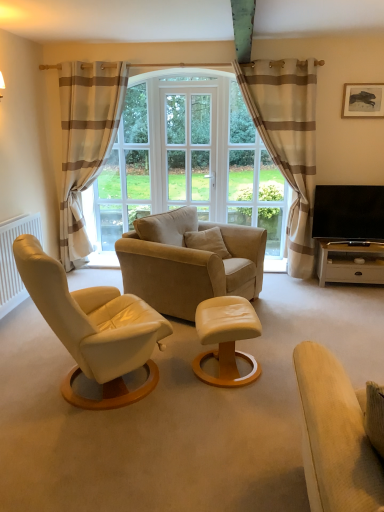
Locate an element on the screen. free space to the right of matte leather ottoman at center, which is the second table in back-to-front order is located at coordinates (276, 365).